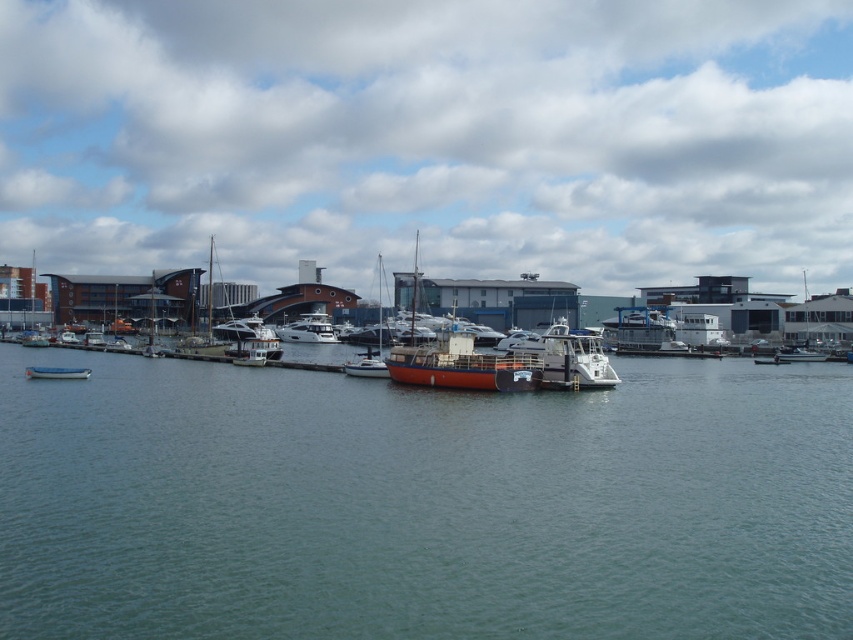
Question: Can you confirm if greenish-blue water at center is positioned below white glossy yacht at center?

Choices:
 (A) no
 (B) yes

Answer: (B)

Question: Which object is the closest to the white glossy boat at center?

Choices:
 (A) greenish-blue water at center
 (B) white glossy yacht at center

Answer: (A)

Question: Which point appears farthest from the camera in this image?

Choices:
 (A) (804, 356)
 (B) (309, 321)
 (C) (84, 378)

Answer: (B)

Question: Does greenish-blue water at center have a larger size compared to metallic silver boat at lower left?

Choices:
 (A) no
 (B) yes

Answer: (B)

Question: Can you confirm if white glossy yacht at center is smaller than white glossy boat at center?

Choices:
 (A) yes
 (B) no

Answer: (B)

Question: Estimate the real-world distances between objects in this image. Which object is closer to the white glossy yacht at center?

Choices:
 (A) metallic silver boat at lower left
 (B) greenish-blue water at center
 (C) white glossy boat at center

Answer: (C)